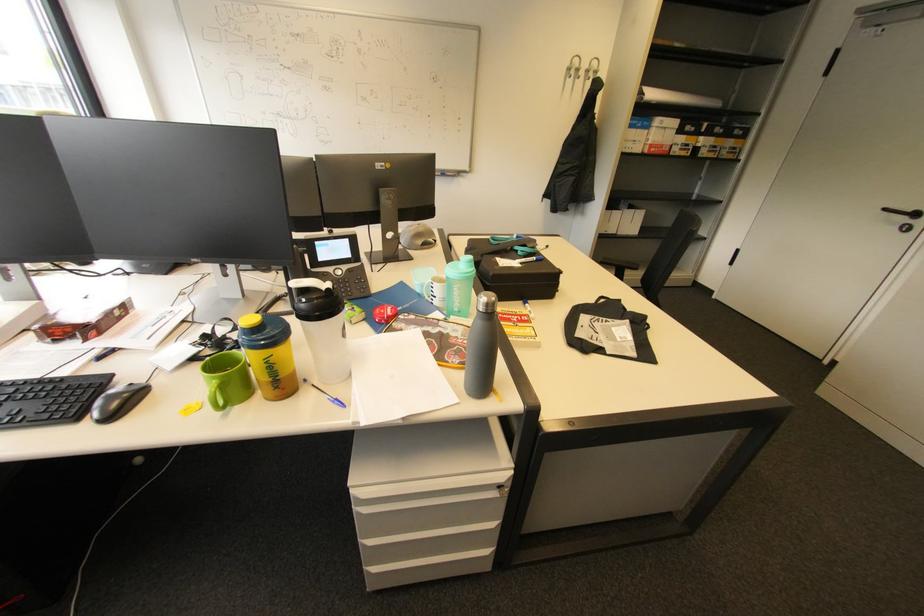
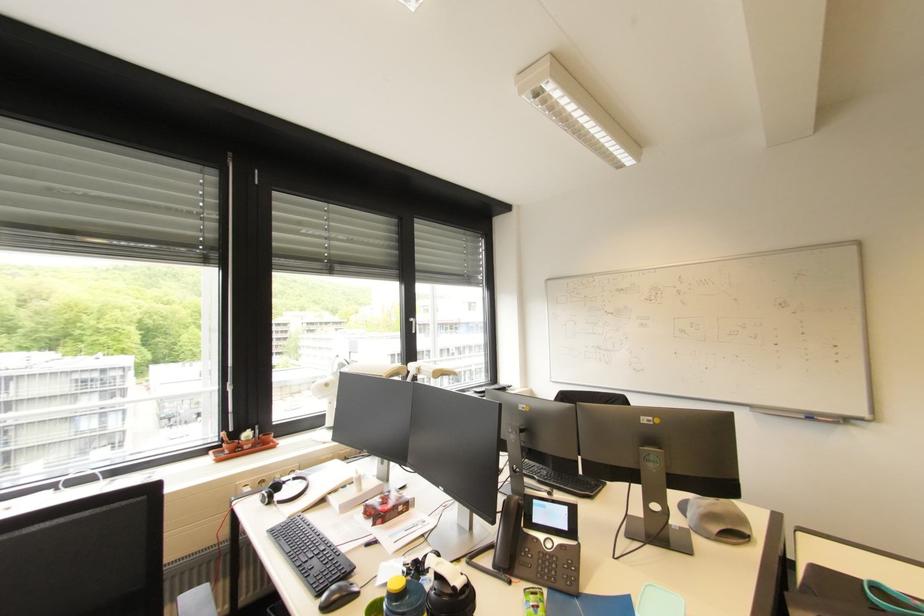
Locate, in the second image, the point that corresponds to the point at 353,241 in the first image.

(572, 509)